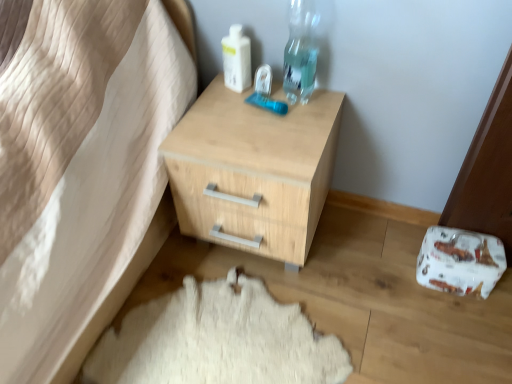
Question: Is the surface of white woolen rug at lower center in direct contact with transparent plastic bottle at upper right?

Choices:
 (A) no
 (B) yes

Answer: (A)

Question: Can you confirm if white woolen rug at lower center is positioned to the left of transparent plastic bottle at upper right?

Choices:
 (A) no
 (B) yes

Answer: (B)

Question: Is white woolen rug at lower center not within transparent plastic bottle at upper right?

Choices:
 (A) no
 (B) yes

Answer: (B)

Question: From the image's perspective, is white woolen rug at lower center on top of transparent plastic bottle at upper right?

Choices:
 (A) no
 (B) yes

Answer: (A)

Question: Considering the relative sizes of white woolen rug at lower center and transparent plastic bottle at upper right in the image provided, is white woolen rug at lower center shorter than transparent plastic bottle at upper right?

Choices:
 (A) yes
 (B) no

Answer: (A)

Question: Does white woolen rug at lower center have a larger size compared to transparent plastic bottle at upper right?

Choices:
 (A) no
 (B) yes

Answer: (B)

Question: Are natural wood chest of drawers at center and white woolen rug at lower center far apart?

Choices:
 (A) yes
 (B) no

Answer: (B)

Question: Can you confirm if natural wood chest of drawers at center is thinner than white woolen rug at lower center?

Choices:
 (A) no
 (B) yes

Answer: (B)

Question: From a real-world perspective, is natural wood chest of drawers at center positioned over white woolen rug at lower center based on gravity?

Choices:
 (A) yes
 (B) no

Answer: (A)

Question: Is natural wood chest of drawers at center aimed at white woolen rug at lower center?

Choices:
 (A) no
 (B) yes

Answer: (B)

Question: Is natural wood chest of drawers at center shorter than white woolen rug at lower center?

Choices:
 (A) yes
 (B) no

Answer: (B)

Question: From the image's perspective, would you say natural wood chest of drawers at center is shown under white woolen rug at lower center?

Choices:
 (A) yes
 (B) no

Answer: (B)

Question: Does transparent plastic bottle at upper right appear on the right side of white plastic bottle at upper center?

Choices:
 (A) no
 (B) yes

Answer: (B)